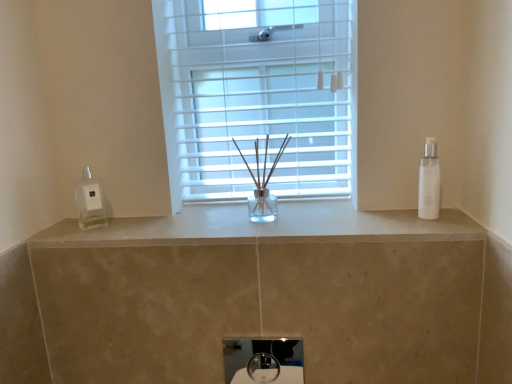
Question: Considering the relative sizes of white glossy bottle at right and white marble counter at center in the image provided, is white glossy bottle at right taller than white marble counter at center?

Choices:
 (A) no
 (B) yes

Answer: (B)

Question: Is white marble counter at center completely or partially inside white glossy bottle at right?

Choices:
 (A) no
 (B) yes

Answer: (A)

Question: Considering the relative sizes of white glossy bottle at right and white marble counter at center in the image provided, is white glossy bottle at right wider than white marble counter at center?

Choices:
 (A) yes
 (B) no

Answer: (B)

Question: Is white glossy bottle at right outside of white marble counter at center?

Choices:
 (A) no
 (B) yes

Answer: (B)

Question: Is white glossy bottle at right directly adjacent to white marble counter at center?

Choices:
 (A) yes
 (B) no

Answer: (B)

Question: Is point (330, 142) positioned closer to the camera than point (411, 223)?

Choices:
 (A) closer
 (B) farther

Answer: (B)

Question: From the image's perspective, is white plastic window at center located above or below white marble counter at center?

Choices:
 (A) below
 (B) above

Answer: (B)

Question: Considering their positions, is white plastic window at center located in front of or behind white marble counter at center?

Choices:
 (A) front
 (B) behind

Answer: (B)

Question: Is white plastic window at center inside the boundaries of white marble counter at center, or outside?

Choices:
 (A) outside
 (B) inside

Answer: (A)

Question: From the image's perspective, relative to white glossy soap dispenser at left, is white glossy bottle at right above or below?

Choices:
 (A) below
 (B) above

Answer: (B)

Question: Visually, is white glossy bottle at right positioned to the left or to the right of white glossy soap dispenser at left?

Choices:
 (A) left
 (B) right

Answer: (B)

Question: Is point (433, 185) closer or farther from the camera than point (103, 216)?

Choices:
 (A) closer
 (B) farther

Answer: (A)

Question: Considering their positions, is white glossy bottle at right located in front of or behind white glossy soap dispenser at left?

Choices:
 (A) behind
 (B) front

Answer: (B)

Question: Considering the positions of white glossy sink at center and white glossy bottle at right in the image, is white glossy sink at center taller or shorter than white glossy bottle at right?

Choices:
 (A) short
 (B) tall

Answer: (A)

Question: Is white glossy sink at center inside the boundaries of white glossy bottle at right, or outside?

Choices:
 (A) outside
 (B) inside

Answer: (A)